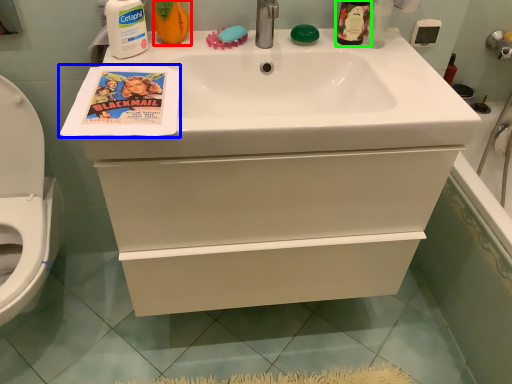
Question: Estimate the real-world distances between objects in this image. Which object is closer to cleaning product (highlighted by a red box), comic book (highlighted by a blue box) or mouthwash (highlighted by a green box)?

Choices:
 (A) comic book
 (B) mouthwash

Answer: (A)